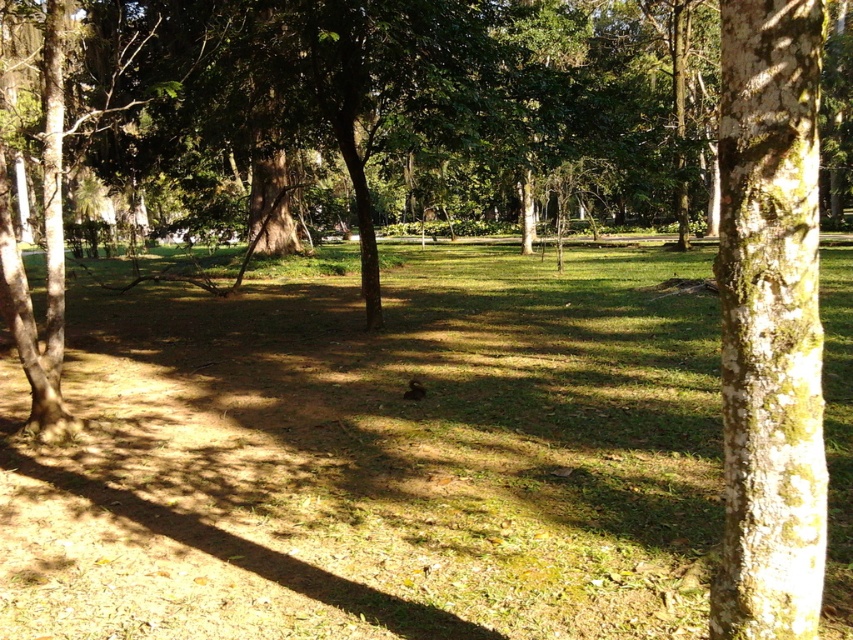
Question: Is green grassy at center above green mossy bark tree trunk at right?

Choices:
 (A) yes
 (B) no

Answer: (B)

Question: Can you confirm if green grassy at center is smaller than green mossy bark tree trunk at right?

Choices:
 (A) no
 (B) yes

Answer: (A)

Question: Which point appears closest to the camera in this image?

Choices:
 (A) (288, 538)
 (B) (753, 141)

Answer: (B)

Question: Does green grassy at center appear on the right side of green mossy bark tree trunk at right?

Choices:
 (A) yes
 (B) no

Answer: (B)

Question: Among these objects, which one is farthest from the camera?

Choices:
 (A) green grassy at center
 (B) green mossy bark tree trunk at right

Answer: (A)

Question: Which of the following is the farthest from the observer?

Choices:
 (A) green mossy bark tree trunk at right
 (B) green grassy at center

Answer: (B)